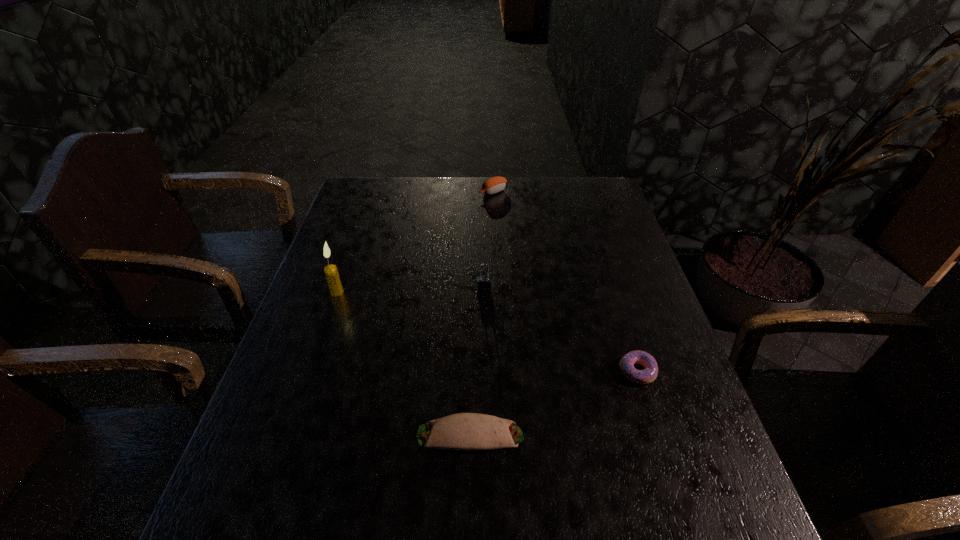
Where is `vacant space at the far left corner`? vacant space at the far left corner is located at coordinates (378, 199).

Find the location of a particular element. This screenshot has width=960, height=540. free space at the far right corner of the desktop is located at coordinates (605, 178).

Image resolution: width=960 pixels, height=540 pixels. In order to click on vacant area that lies between the candle and the fourth shortest object in this screenshot , I will do `click(411, 291)`.

Locate an element on the screen. The height and width of the screenshot is (540, 960). vacant space that's between the padlock and the fourth farthest object is located at coordinates (561, 330).

This screenshot has width=960, height=540. Find the location of `unoccupied area between the sushi and the fourth farthest object`. unoccupied area between the sushi and the fourth farthest object is located at coordinates (565, 281).

Find the location of `unoccupied position between the farthest object and the fourth shortest object`. unoccupied position between the farthest object and the fourth shortest object is located at coordinates (489, 240).

Locate an element on the screen. This screenshot has width=960, height=540. vacant space that's between the farthest object and the rightmost object is located at coordinates (565, 281).

Find the location of a particular element. Image resolution: width=960 pixels, height=540 pixels. blank region between the fourth shortest object and the tallest object is located at coordinates (411, 291).

Locate an element on the screen. The width and height of the screenshot is (960, 540). vacant space in between the sushi and the nearest object is located at coordinates (482, 313).

This screenshot has width=960, height=540. I want to click on vacant area between the leftmost object and the second tallest object, so click(x=411, y=291).